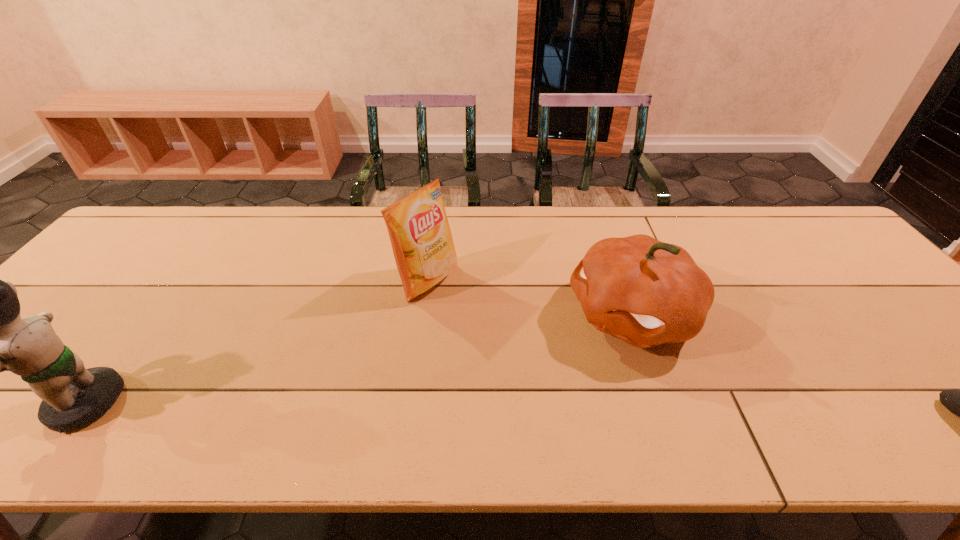
Find the location of a particular element. This screenshot has width=960, height=540. free space on the desktop that is between the leftmost object and the rightmost object and is positioned on the front face of the pumpkin is located at coordinates (462, 413).

Where is `vacant space on the desktop that is between the tallest object and the rightmost object and is positioned on the front-facing side of the second object from left to right`? vacant space on the desktop that is between the tallest object and the rightmost object and is positioned on the front-facing side of the second object from left to right is located at coordinates (666, 419).